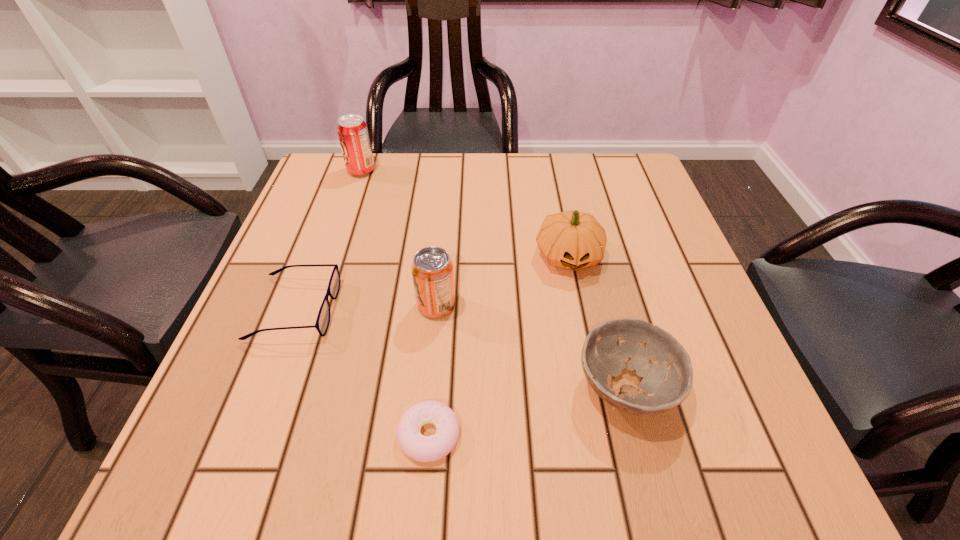
Identify the location of free space that is in between the nearer soda can and the gourd. (502, 281).

At what (x,y) coordinates should I click in order to perform the action: click on free space that is in between the left soda can and the bowl. Please return your answer as a coordinate pair (x, y). Looking at the image, I should click on (493, 279).

Where is `free point between the nearer soda can and the second shortest object`? free point between the nearer soda can and the second shortest object is located at coordinates (366, 307).

Locate an element on the screen. unoccupied position between the shortest object and the nearer soda can is located at coordinates (433, 370).

Find the location of a particular element. vacant point located between the spectacles and the farthest object is located at coordinates (328, 240).

You are a GUI agent. You are given a task and a screenshot of the screen. Output one action in this format:
    pyautogui.click(x=<x>, y=<y>)
    Task: Click on the empty space that is in between the fourth tallest object and the right soda can
    
    Given the screenshot: What is the action you would take?
    pyautogui.click(x=531, y=347)

Identify which object is the fourth closest to the doughnut. Please provide its 2D coordinates. Your answer should be formatted as a tuple, i.e. [(x, y)], where the tuple contains the x and y coordinates of a point satisfying the conditions above.

[(573, 240)]

At what (x,y) coordinates should I click in order to perform the action: click on object that is the closest to the bowl. Please return your answer as a coordinate pair (x, y). The width and height of the screenshot is (960, 540). Looking at the image, I should click on (573, 240).

Where is `vacant area that satisfies the following two spatial constraints: 1. on the front-facing side of the third shortest object; 2. on the right side of the fifth tallest object`? This screenshot has width=960, height=540. vacant area that satisfies the following two spatial constraints: 1. on the front-facing side of the third shortest object; 2. on the right side of the fifth tallest object is located at coordinates (266, 387).

Locate an element on the screen. The image size is (960, 540). vacant region that satisfies the following two spatial constraints: 1. on the back side of the doughnut; 2. on the front-facing side of the spectacles is located at coordinates (440, 308).